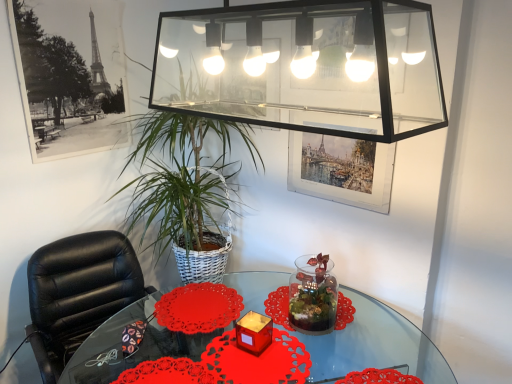
Question: Is translucent glass candle at center looking in the opposite direction of transparent glass vase at center?

Choices:
 (A) yes
 (B) no

Answer: (B)

Question: Would you say translucent glass candle at center contains transparent glass vase at center?

Choices:
 (A) yes
 (B) no

Answer: (B)

Question: From a real-world perspective, is translucent glass candle at center beneath transparent glass vase at center?

Choices:
 (A) yes
 (B) no

Answer: (A)

Question: Can you confirm if translucent glass candle at center is taller than transparent glass vase at center?

Choices:
 (A) no
 (B) yes

Answer: (A)

Question: Is translucent glass candle at center outside transparent glass vase at center?

Choices:
 (A) yes
 (B) no

Answer: (A)

Question: Does translucent glass candle at center touch transparent glass vase at center?

Choices:
 (A) yes
 (B) no

Answer: (B)

Question: Is black leather chair at left taller than transparent glass vase at center?

Choices:
 (A) no
 (B) yes

Answer: (B)

Question: Is black leather chair at left touching transparent glass vase at center?

Choices:
 (A) no
 (B) yes

Answer: (A)

Question: Is there a large distance between black leather chair at left and transparent glass vase at center?

Choices:
 (A) no
 (B) yes

Answer: (A)

Question: Is black leather chair at left outside of transparent glass vase at center?

Choices:
 (A) yes
 (B) no

Answer: (A)

Question: Considering the relative sizes of black leather chair at left and transparent glass vase at center in the image provided, is black leather chair at left bigger than transparent glass vase at center?

Choices:
 (A) no
 (B) yes

Answer: (B)

Question: From the image's perspective, would you say black leather chair at left is shown under transparent glass vase at center?

Choices:
 (A) yes
 (B) no

Answer: (A)

Question: Considering the relative sizes of translucent glass candle at center and black leather chair at left in the image provided, is translucent glass candle at center bigger than black leather chair at left?

Choices:
 (A) no
 (B) yes

Answer: (A)